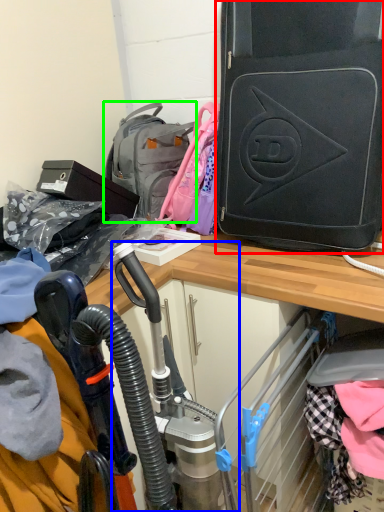
Question: Which object is the farthest from luggage and bags (highlighted by a red box)? Choose among these: sport equipment (highlighted by a blue box) or backpack (highlighted by a green box).

Choices:
 (A) sport equipment
 (B) backpack

Answer: (A)